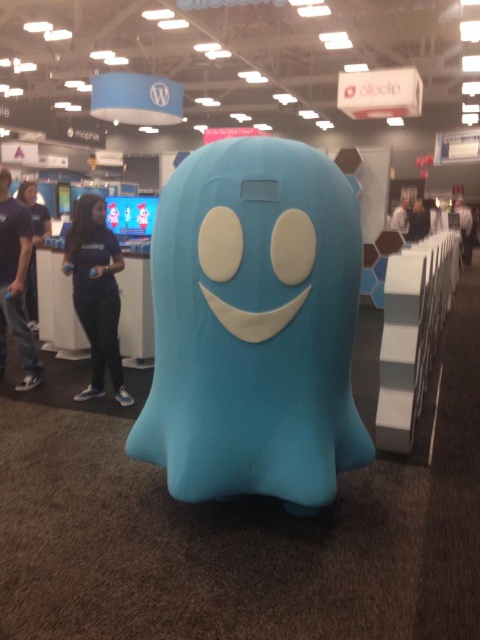
In the scene shown: You are standing at the entrance of the convention hall and see the white matte shirt at center. If you walk directly towards it, what coordinate point will you reach?

You will reach the coordinate point at (399, 218) where the white matte shirt at center is located.

You are at a trade show and see the dark gray fabric jacket at center. Where exactly is it located in terms of coordinates?

The dark gray fabric jacket at center is located at point (x=465, y=228).